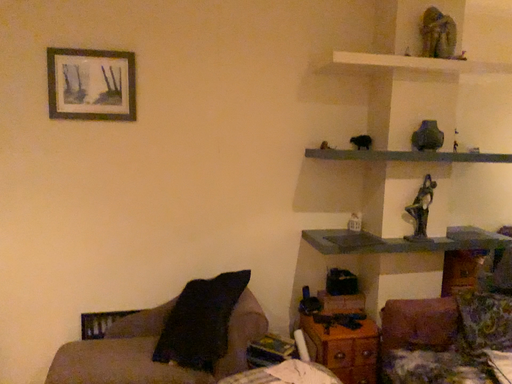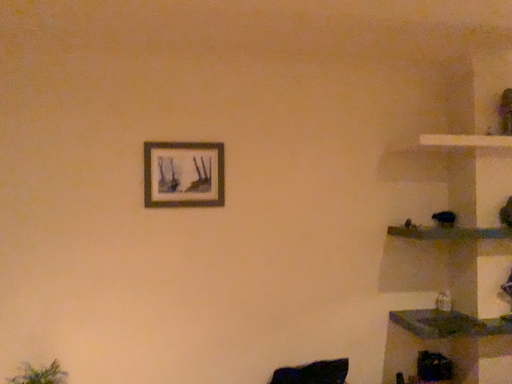
Question: Which way did the camera rotate in the video?

Choices:
 (A) rotated downward
 (B) rotated upward

Answer: (B)